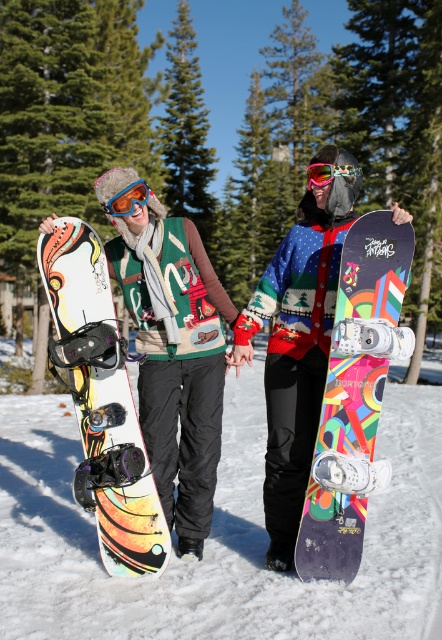
Does matte black snowboard at center have a larger size compared to matte snowboard at left?

Yes.

Measure the distance between point (338, 621) and camera.

Point (338, 621) is 3.64 meters from camera.

You are a GUI agent. You are given a task and a screenshot of the screen. Output one action in this format:
    pyautogui.click(x=<x>, y=<y>)
    Task: Click on the matte black snowboard at center
    The height and width of the screenshot is (640, 442).
    Given the screenshot: What is the action you would take?
    pyautogui.click(x=217, y=538)

Is matte black snowboard at center wider than multicolored glossy snowboard at center?

Yes, matte black snowboard at center is wider than multicolored glossy snowboard at center.

The height and width of the screenshot is (640, 442). Describe the element at coordinates (217, 538) in the screenshot. I see `matte black snowboard at center` at that location.

Is point (402, 621) positioned in front of point (388, 260)?

That is True.

Where is `matte black snowboard at center`? This screenshot has height=640, width=442. matte black snowboard at center is located at coordinates (217, 538).

Looking at this image, does green textured pine trees at upper center have a larger size compared to multicolored glossy snowboard at center?

Correct, green textured pine trees at upper center is larger in size than multicolored glossy snowboard at center.

Is green textured pine trees at upper center thinner than multicolored glossy snowboard at center?

Incorrect, green textured pine trees at upper center's width is not less than multicolored glossy snowboard at center's.

Who is more distant from viewer, (354, 93) or (377, 246)?

The point (354, 93) is behind.

At what (x,y) coordinates should I click in order to perform the action: click on green textured pine trees at upper center. Please return your answer as a coordinate pair (x, y). The height and width of the screenshot is (640, 442). Looking at the image, I should click on (209, 125).